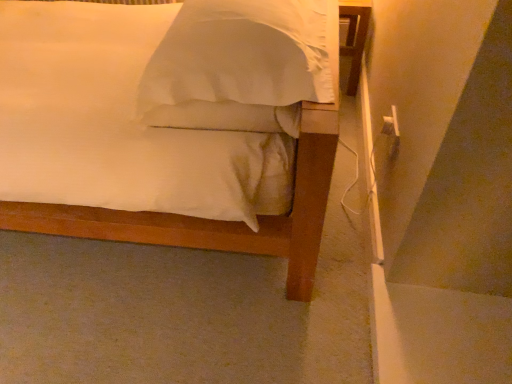
What is the approximate width of white satin bed at center?

The width of white satin bed at center is 22.59 inches.

The width and height of the screenshot is (512, 384). What do you see at coordinates (219, 221) in the screenshot? I see `white satin bed at center` at bounding box center [219, 221].

Locate an element on the screen. white satin bed at center is located at coordinates (219, 221).

The image size is (512, 384). I want to click on white satin bed at center, so click(x=219, y=221).